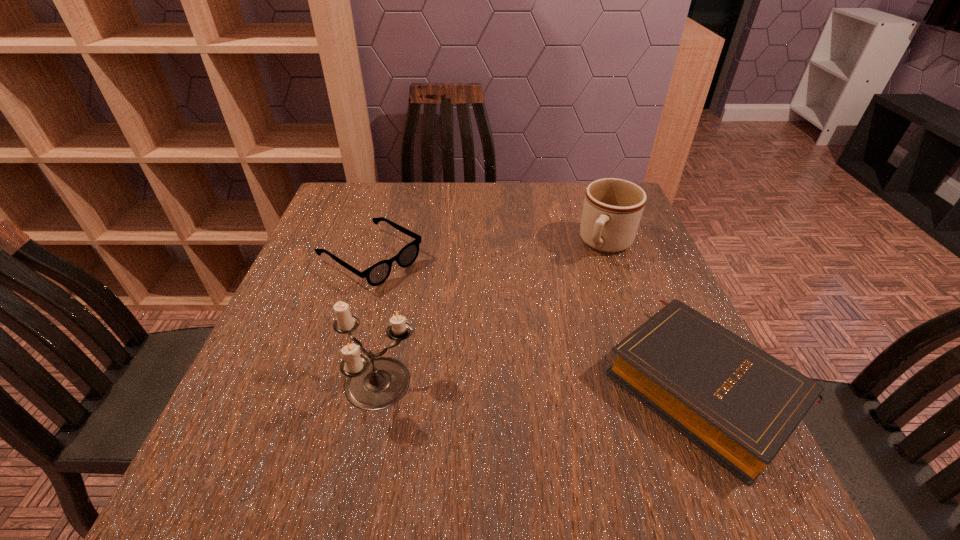
Image resolution: width=960 pixels, height=540 pixels. In order to click on vacant space on the desktop that is between the tallest object and the Bible and is positioned on the arms of the spectacles in this screenshot , I will do `click(569, 385)`.

Where is `free space on the desktop that is between the tallest object and the Bible and is positioned on the side of the mug with the handle`? The height and width of the screenshot is (540, 960). free space on the desktop that is between the tallest object and the Bible and is positioned on the side of the mug with the handle is located at coordinates (512, 386).